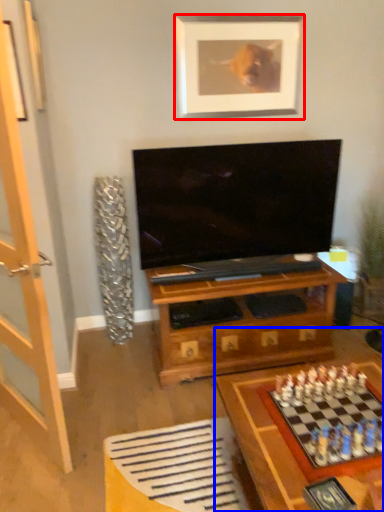
Question: Which object appears closest to the camera in this image, picture frame (highlighted by a red box) or table (highlighted by a blue box)?

Choices:
 (A) picture frame
 (B) table

Answer: (B)